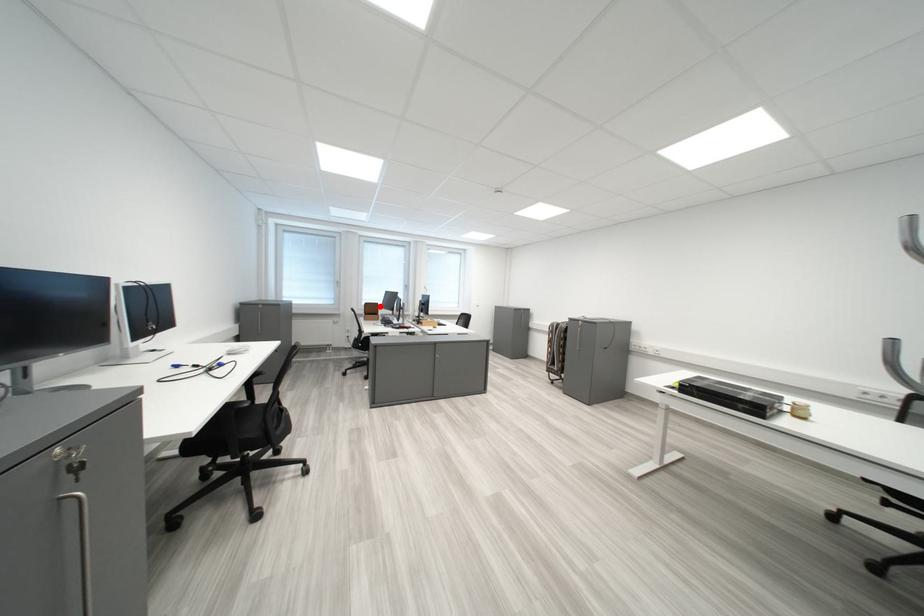
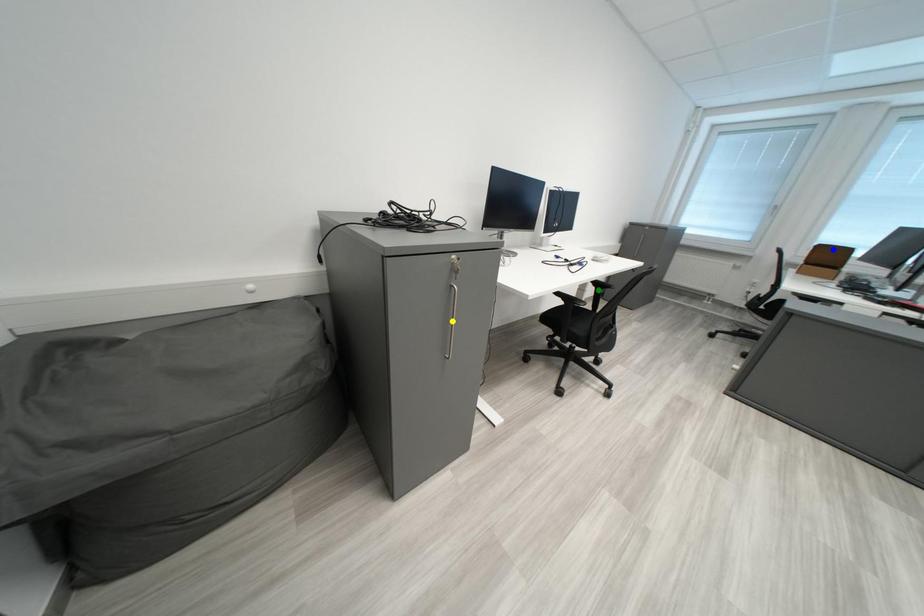
Question: I am providing you with two images of the same scene from different viewpoints. A red point is marked on the first image. You are given multiple points on the second image. Can you choose the point in image 2 that corresponds to the point in image 1?

Choices:
 (A) green point
 (B) blue point
 (C) yellow point

Answer: (B)